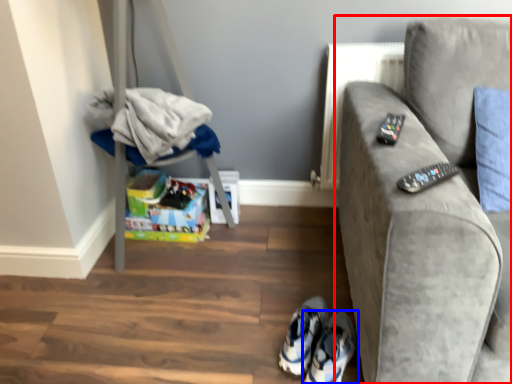
Question: Which point is further to the camera, studio couch (highlighted by a red box) or footwear (highlighted by a blue box)?

Choices:
 (A) studio couch
 (B) footwear

Answer: (B)